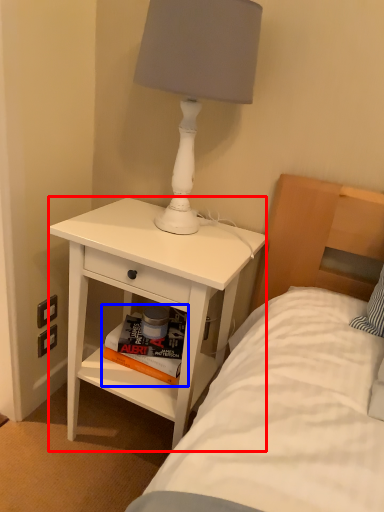
Question: Which point is further to the camera, nightstand (highlighted by a red box) or magazine (highlighted by a blue box)?

Choices:
 (A) nightstand
 (B) magazine

Answer: (B)